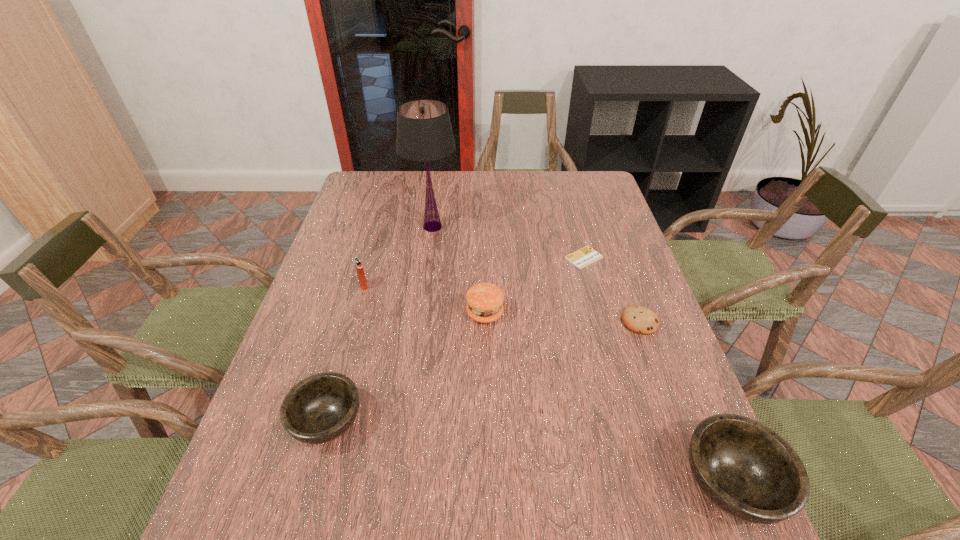
Find the location of a particular element. the shorter bowl is located at coordinates (320, 408).

This screenshot has width=960, height=540. What are the coordinates of `the right bowl` in the screenshot? It's located at (746, 469).

Find the location of a particular element. the tallest object is located at coordinates (424, 133).

Find the location of a particular element. This screenshot has height=540, width=960. lampshade is located at coordinates (424, 133).

Image resolution: width=960 pixels, height=540 pixels. I want to click on the shortest object, so [586, 255].

Image resolution: width=960 pixels, height=540 pixels. In order to click on the sixth nearest object in this screenshot , I will do `click(586, 255)`.

I want to click on cookie, so click(638, 319).

The image size is (960, 540). I want to click on igniter, so click(358, 263).

You are a GUI agent. You are given a task and a screenshot of the screen. Output one action in this format:
    pyautogui.click(x=<x>, y=<y>)
    Task: Click on the patty
    The height and width of the screenshot is (540, 960).
    Given the screenshot: What is the action you would take?
    pyautogui.click(x=485, y=300)

Where is `free space located on the right of the left bowl`? Image resolution: width=960 pixels, height=540 pixels. free space located on the right of the left bowl is located at coordinates (489, 422).